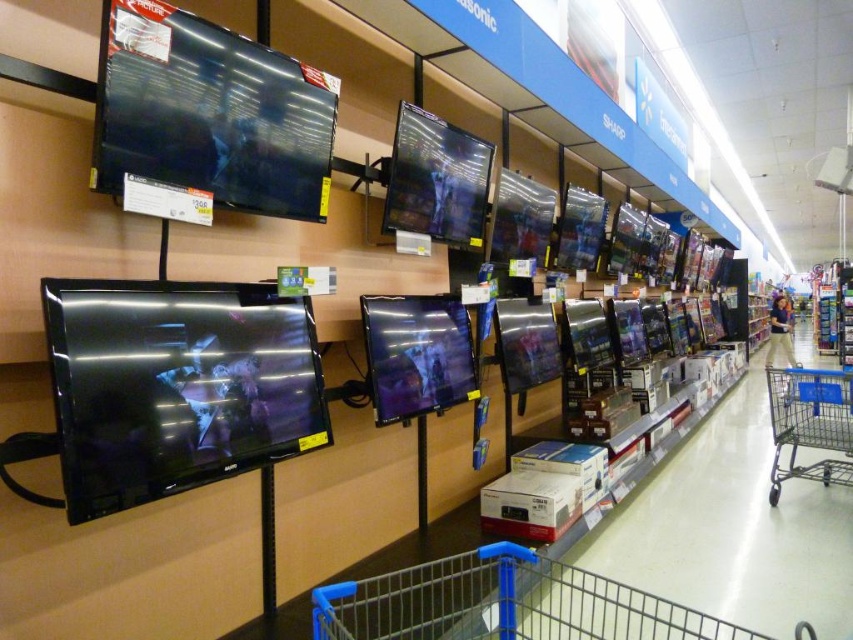
You are a customer in the electronics store looking at the TVs. You want to pick up the beige cotton pants at lower right to try on. Can you reach it without moving the metallic gray shopping cart at lower right?

The metallic gray shopping cart at lower right is positioned under beige cotton pants at lower right, so the shopping cart is blocking access to the pants. You would need to move the shopping cart to reach the beige cotton pants at lower right.

You are standing in the electronics store and notice both the metallic gray shopping cart at lower right and the beige cotton pants at lower right. From your perspective, which one is positioned to the left?

The metallic gray shopping cart at lower right is positioned to the left of the beige cotton pants at lower right.

You are a customer in the electronics store and want to pick up a box from the shelves below the TVs. Where is the blue metal shopping cart at lower center located in relation to your current position?

The blue metal shopping cart at lower center is located at point 0.944 on the x axis and 0.592 on the y axis.